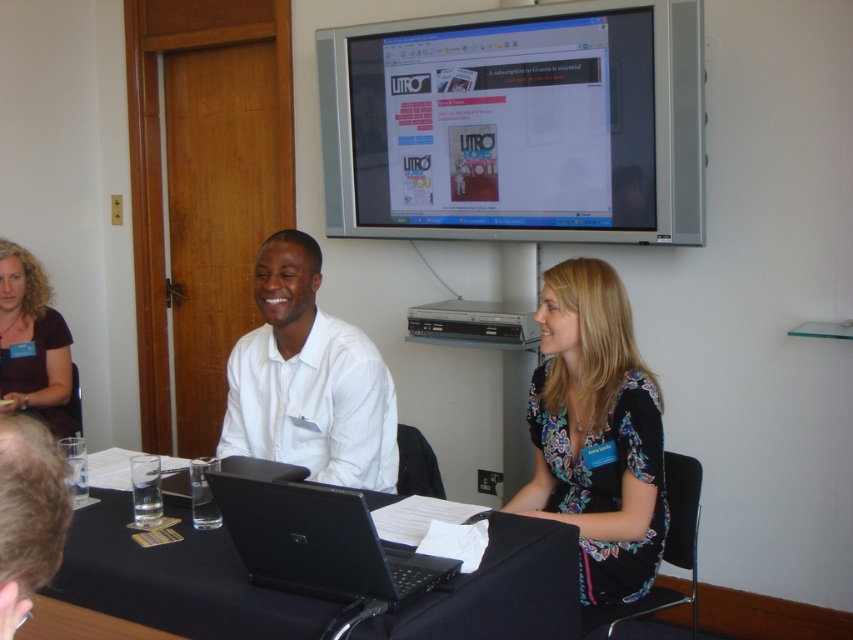
You are an interior designer assessing the conference room layout. The matte plastic monitor at upper center and the white smooth shirt at center are both in your line of sight. Which object appears bigger in the image?

The matte plastic monitor at upper center has a larger size compared to the white smooth shirt at center, so it appears bigger in the image.

You are organizing a presentation and need to place a name tag on the table. The name tag is 10 cm wide. Can the black glossy laptop at center and the dark brown hair at lower left both fit on the table with the name tag without overlapping?

The black glossy laptop at center is smaller than dark brown hair at lower left. Since the name tag is 10 cm wide, it depends on the available space between them. However, since the laptop is smaller, there might be enough space if positioned carefully.

You are a photographer trying to capture a clear shot of the black glossy laptop at center and the dark brown hair at lower left. Since the laptop is under the hair, will you need to adjust your angle to avoid obstruction?

The black glossy laptop at center is positioned under dark brown hair at lower left, so adjusting your angle might be necessary to avoid the hair obstructing the view of the laptop.